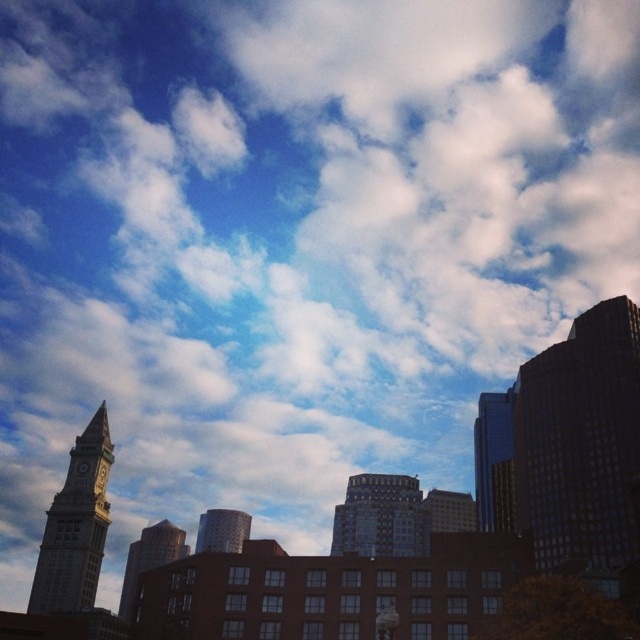
Does point (614, 314) come farther from viewer compared to point (508, 440)?

No.

The width and height of the screenshot is (640, 640). I want to click on dark glass skyscraper at right, so click(x=580, y=440).

Find the location of `dark glass skyscraper at right`. dark glass skyscraper at right is located at coordinates (580, 440).

Does stone clock tower at left have a lesser height compared to gold metallic clock at lower left?

In fact, stone clock tower at left may be taller than gold metallic clock at lower left.

Which is behind, point (83, 602) or point (99, 458)?

The point (99, 458) is behind.

You are a GUI agent. You are given a task and a screenshot of the screen. Output one action in this format:
    pyautogui.click(x=<x>, y=<y>)
    Task: Click on the stone clock tower at left
    
    Given the screenshot: What is the action you would take?
    pyautogui.click(x=74, y=529)

Which is below, shiny glass skyscraper at right or smooth glass building at center?

smooth glass building at center

Consider the image. Which is more to the left, shiny glass skyscraper at right or smooth glass building at center?

smooth glass building at center is more to the left.

Does point (497, 448) come behind point (228, 545)?

That is False.

At what (x,y) coordinates should I click in order to perform the action: click on shiny glass skyscraper at right. Please return your answer as a coordinate pair (x, y). The width and height of the screenshot is (640, 640). Looking at the image, I should click on (490, 448).